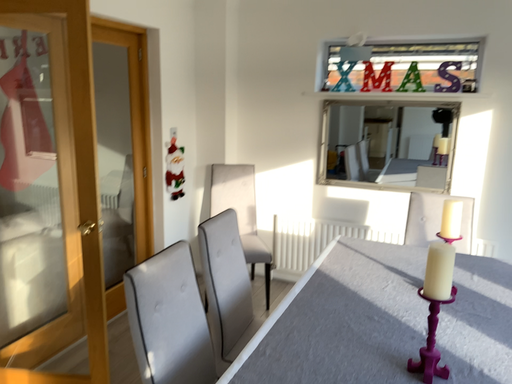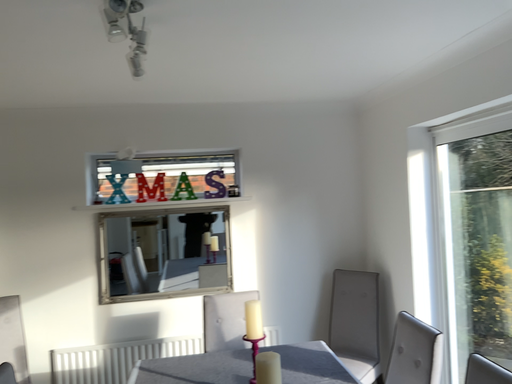
Question: Which way did the camera rotate in the video?

Choices:
 (A) rotated right
 (B) rotated left

Answer: (A)